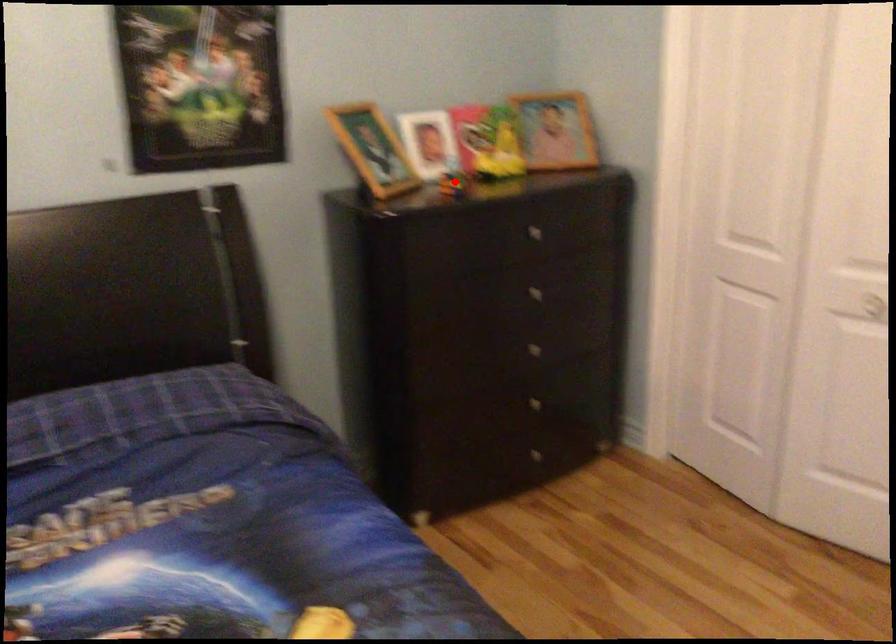
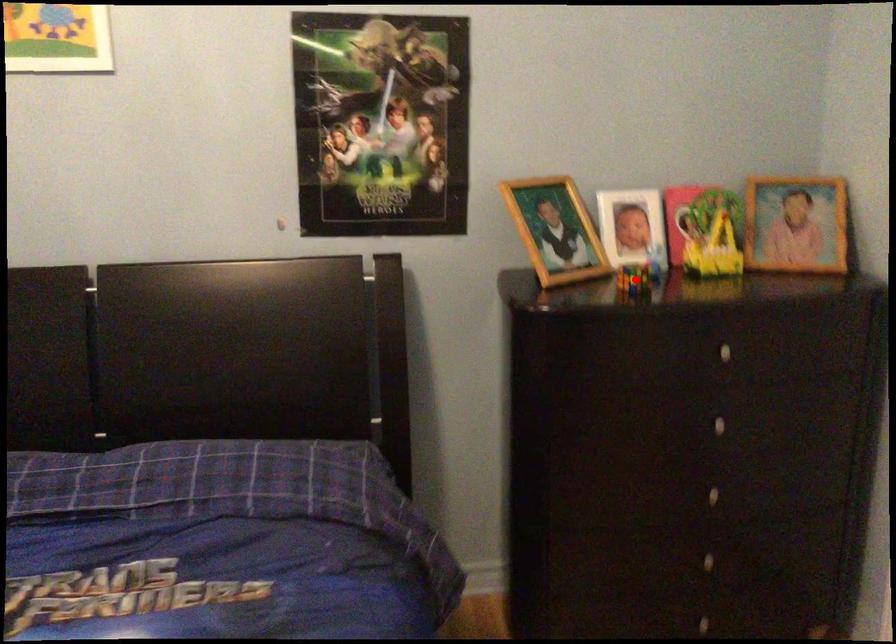
I am providing you with two images of the same scene from different viewpoints. A red point is marked on the first image and another point is marked on the second image. Is the red point in image1 aligned with the point shown in image2?

Yes